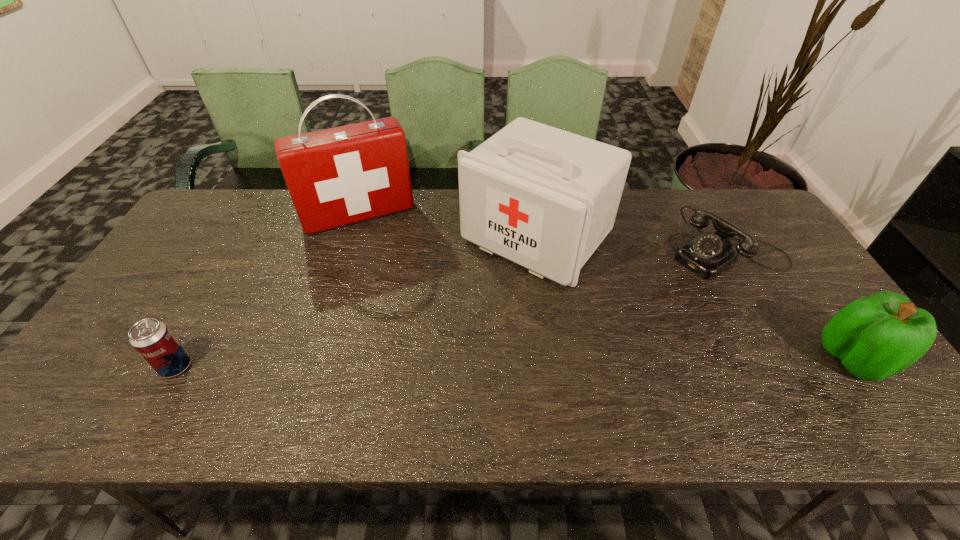
The height and width of the screenshot is (540, 960). In order to click on blank space located 0.370m on the front-facing side of the third object from right to left in this screenshot , I will do `click(405, 374)`.

This screenshot has height=540, width=960. What are the coordinates of `vacant region located on the front-facing side of the shortest object` in the screenshot? It's located at (625, 310).

The image size is (960, 540). What are the coordinates of `free space located 0.240m on the front-facing side of the shortest object` in the screenshot? It's located at (633, 306).

Where is `vacant position located on the front-facing side of the shortest object`? This screenshot has width=960, height=540. vacant position located on the front-facing side of the shortest object is located at coordinates (630, 307).

In order to click on vacant region located on the front face of the left first-aid kit in this screenshot , I will do `click(379, 245)`.

Find the location of `blank space located on the front face of the left first-aid kit`. blank space located on the front face of the left first-aid kit is located at coordinates (403, 303).

Locate an element on the screen. vacant space located 0.270m on the front face of the left first-aid kit is located at coordinates (400, 295).

Locate an element on the screen. The width and height of the screenshot is (960, 540). telephone that is positioned at the far edge is located at coordinates (708, 254).

At what (x,y) coordinates should I click in order to perform the action: click on beer can that is at the near edge. Please return your answer as a coordinate pair (x, y). Looking at the image, I should click on (152, 339).

Find the location of a particular element. bell pepper that is positioned at the near edge is located at coordinates (875, 337).